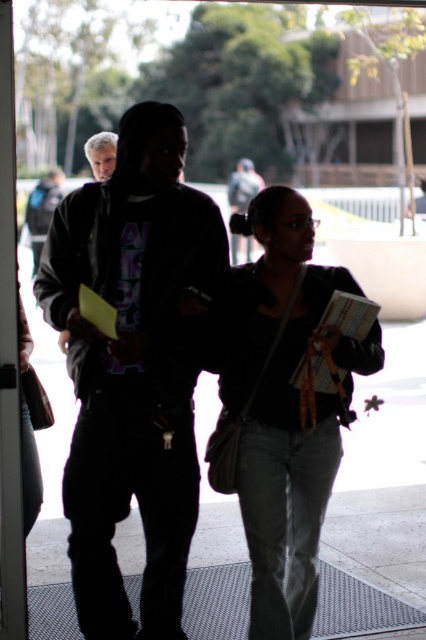
Question: Does dark matte jacket at center have a lesser width compared to matte black hoodie at center?

Choices:
 (A) no
 (B) yes

Answer: (A)

Question: Among these points, which one is nearest to the camera?

Choices:
 (A) (161, 422)
 (B) (287, 515)
 (C) (92, 147)

Answer: (A)

Question: Is denim jeans at center closer to the viewer compared to matte black hoodie at center?

Choices:
 (A) yes
 (B) no

Answer: (A)

Question: Which point is closer to the camera?

Choices:
 (A) (296, 634)
 (B) (57, 272)
 (C) (97, 147)

Answer: (B)

Question: Which point appears farthest from the camera in this image?

Choices:
 (A) (92, 170)
 (B) (365, 502)

Answer: (A)

Question: Where is gray rubber mat at lower center located in relation to matte black hoodie at center in the image?

Choices:
 (A) below
 (B) above

Answer: (A)